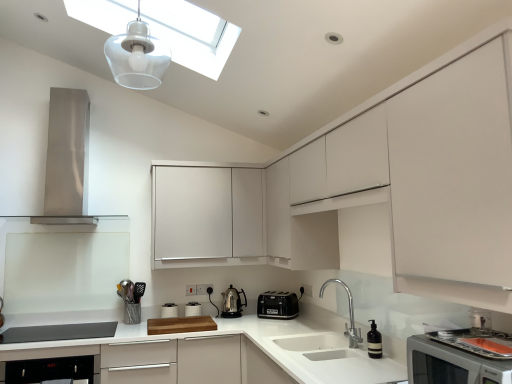
I want to click on vacant space that is to the left of polished stainless steel faucet at lower center, so 310,342.